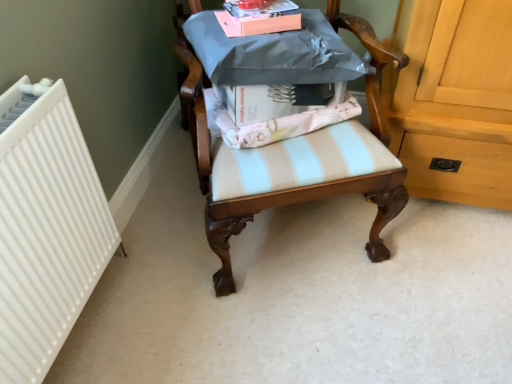
Identify the location of free space in front of wooden chair at center. This screenshot has height=384, width=512. (300, 332).